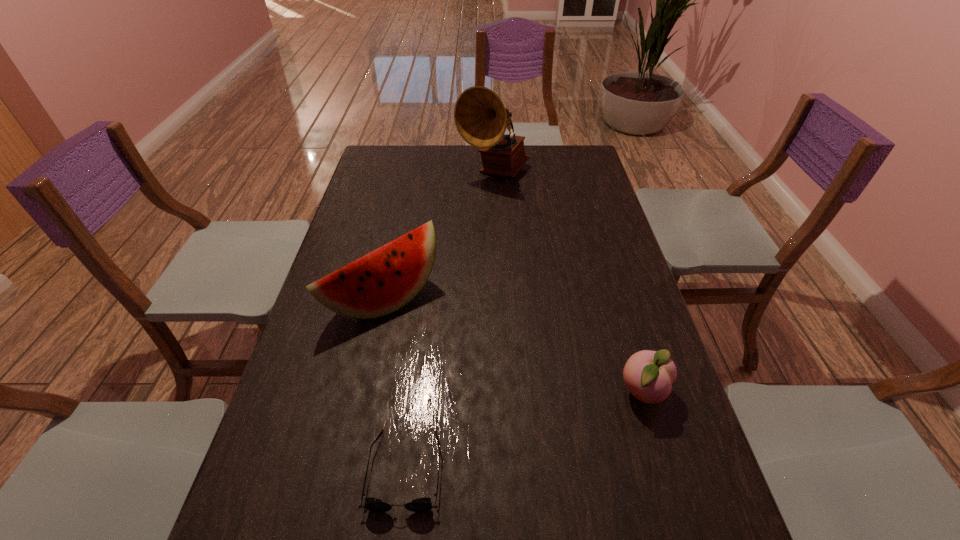
Locate an element on the screen. vacant point located between the third tallest object and the nearest object is located at coordinates (524, 431).

Find the location of a particular element. The width and height of the screenshot is (960, 540). free space between the sunglasses and the third shortest object is located at coordinates (395, 384).

The height and width of the screenshot is (540, 960). Find the location of `vacant area between the shortest object and the second farthest object`. vacant area between the shortest object and the second farthest object is located at coordinates (395, 384).

What are the coordinates of `vacant space that's between the phonograph record and the shortest object` in the screenshot? It's located at (449, 321).

Where is `free space between the third tallest object and the second tallest object`? free space between the third tallest object and the second tallest object is located at coordinates (514, 346).

Identify which object is located as the second nearest to the second shortest object. Please provide its 2D coordinates. Your answer should be formatted as a tuple, i.e. [(x, y)], where the tuple contains the x and y coordinates of a point satisfying the conditions above.

[(386, 279)]

Choose which object is the second nearest neighbor to the third farthest object. Please provide its 2D coordinates. Your answer should be formatted as a tuple, i.e. [(x, y)], where the tuple contains the x and y coordinates of a point satisfying the conditions above.

[(386, 279)]